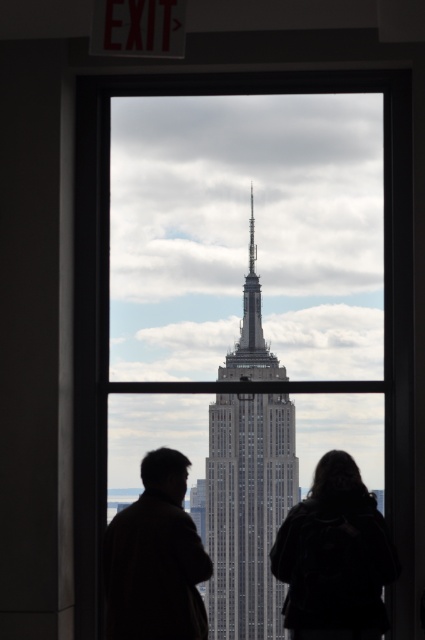
You are standing in a room with a window showing the Empire State Building. You notice a point marked at coordinates (159,525). If you want to estimate how far this point is from your current position, what would you say?

The point at coordinates (159,525) is 490.92 meters away from the camera, so the distance from your current position to that point is approximately 490.92 meters.

You are organizing a fashion show and need to arrange the silhouette clothing at center and the black leather jacket at center in a straight line from left to right. Based on their current positions, which item should be placed first on the left side?

The silhouette clothing at center should be placed first on the left side since it is currently positioned to the left of the black leather jacket at center.

You are an interior designer assessing the placement of two decorative lights in a room. You have two points marked as potential locations for the lights. The first point is at coordinates point (334, 476), and the second is at point (340, 616). Based on the scene provided, which point is closer to the window frame?

Point (334, 476) is further to the viewer than point (340, 616), so the point closer to the window frame is point (340, 616).